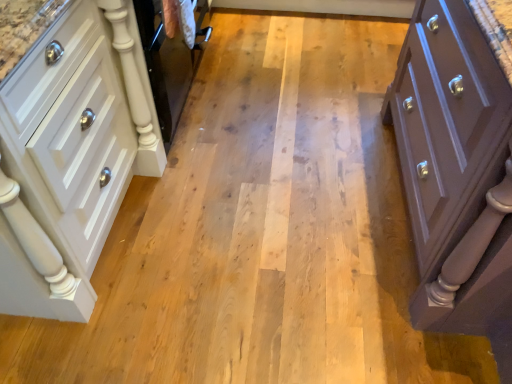
Question: Is white glossy cabinet at left, the 2th chest of drawers when ordered from right to left, spatially inside matte purple chest of drawers at right, which ranks as the first chest of drawers in right-to-left order, or outside of it?

Choices:
 (A) outside
 (B) inside

Answer: (A)

Question: From their relative heights in the image, would you say white glossy cabinet at left, which is the 1th chest of drawers in left-to-right order, is taller or shorter than matte purple chest of drawers at right, which ranks as the first chest of drawers in right-to-left order?

Choices:
 (A) short
 (B) tall

Answer: (A)

Question: Considering the relative positions of white glossy cabinet at left, which is the 1th chest of drawers in left-to-right order, and matte purple chest of drawers at right, which ranks as the first chest of drawers in right-to-left order, in the image provided, is white glossy cabinet at left, which is the 1th chest of drawers in left-to-right order, to the left or to the right of matte purple chest of drawers at right, which ranks as the first chest of drawers in right-to-left order,?

Choices:
 (A) left
 (B) right

Answer: (A)

Question: In terms of size, does matte purple chest of drawers at right, which ranks as the first chest of drawers in right-to-left order, appear bigger or smaller than white glossy cabinet at left, which is the 1th chest of drawers in left-to-right order?

Choices:
 (A) small
 (B) big

Answer: (B)

Question: Is matte purple chest of drawers at right, marked as the 2th chest of drawers in a left-to-right arrangement, inside the boundaries of white glossy cabinet at left, which is the 1th chest of drawers in left-to-right order, or outside?

Choices:
 (A) inside
 (B) outside

Answer: (B)

Question: In terms of height, does matte purple chest of drawers at right, marked as the 2th chest of drawers in a left-to-right arrangement, look taller or shorter compared to white glossy cabinet at left, the 2th chest of drawers when ordered from right to left?

Choices:
 (A) tall
 (B) short

Answer: (A)

Question: Is point (470, 96) positioned closer to the camera than point (19, 200)?

Choices:
 (A) farther
 (B) closer

Answer: (A)